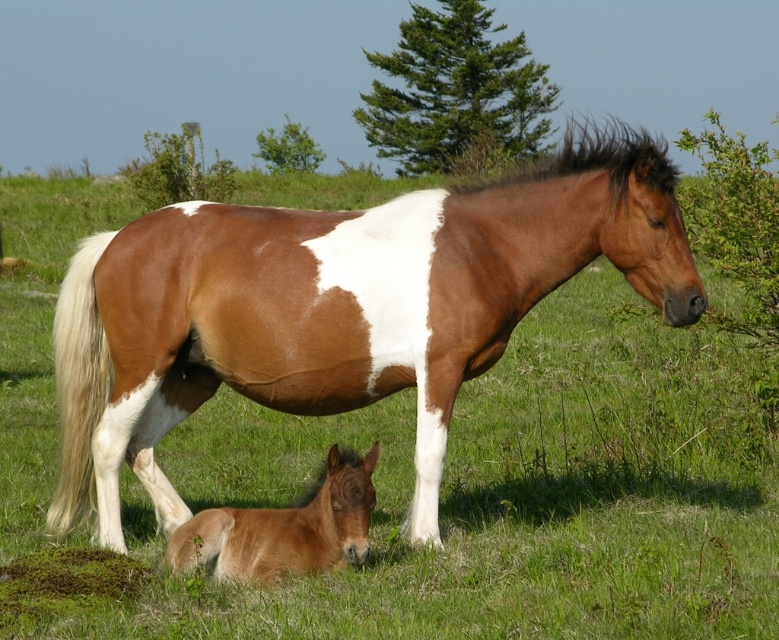
You are a farmer checking the field. You notice the brown glossy horse at center and the brown matte foal at lower left. Which one has a smaller width?

The brown glossy horse at center has a smaller width than the brown matte foal at lower left according to the description.

Where is the brown glossy horse at center located in the image?

The brown glossy horse at center is located at point 0.483 on the horizontal axis and point 0.436 on the vertical axis.